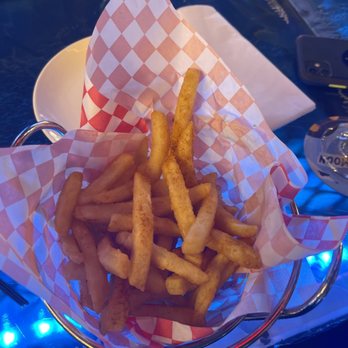
Where is `light reflections`? The height and width of the screenshot is (348, 348). light reflections is located at coordinates tap(319, 203), tap(306, 184), tap(315, 184), tap(341, 18), tap(324, 8).